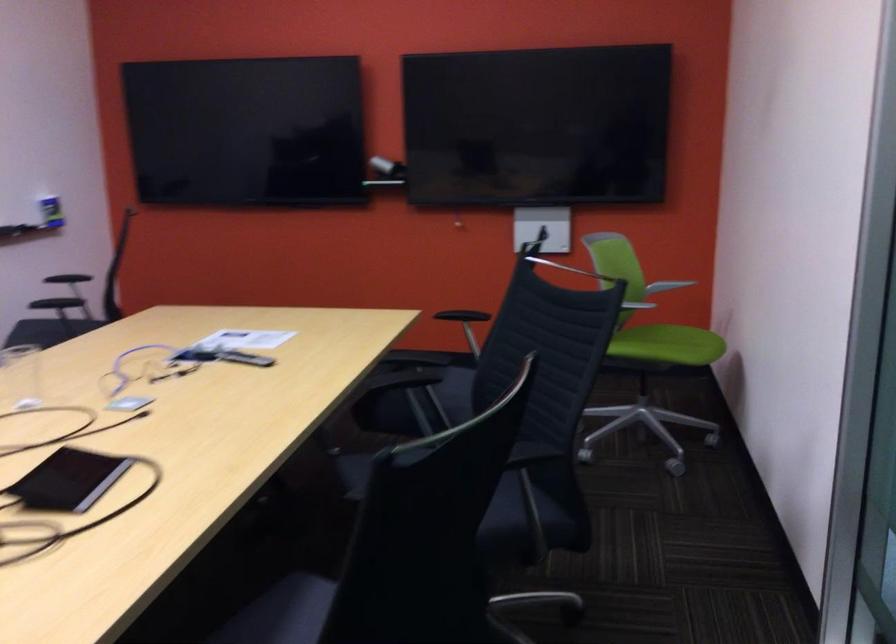
What do you see at coordinates (667, 345) in the screenshot?
I see `a green chair sitting surface` at bounding box center [667, 345].